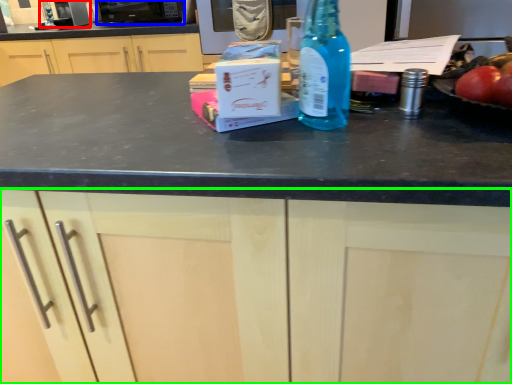
Question: Which is nearer to the appliance (highlighted by a red box)? appliance (highlighted by a blue box) or cabinetry (highlighted by a green box).

Choices:
 (A) appliance
 (B) cabinetry

Answer: (A)